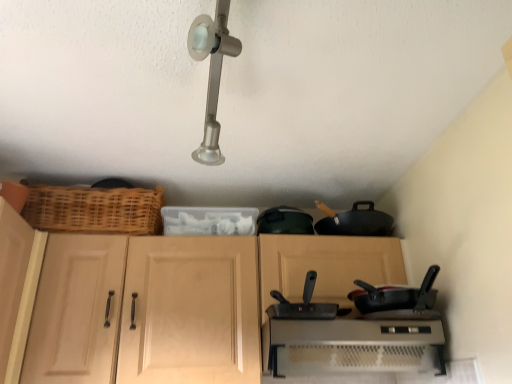
Question: Is the depth of black matte frying pan at right less than that of light wood cabinet at left?

Choices:
 (A) no
 (B) yes

Answer: (A)

Question: From a real-world perspective, is black matte frying pan at right positioned over light wood cabinet at left based on gravity?

Choices:
 (A) yes
 (B) no

Answer: (B)

Question: Would you say black matte frying pan at right contains light wood cabinet at left?

Choices:
 (A) no
 (B) yes

Answer: (A)

Question: Does black matte frying pan at right have a greater width compared to light wood cabinet at left?

Choices:
 (A) yes
 (B) no

Answer: (A)

Question: Is black matte frying pan at right at the right side of light wood cabinet at left?

Choices:
 (A) yes
 (B) no

Answer: (A)

Question: Visually, is light wood cabinet at left positioned to the left or to the right of metallic silver toaster at lower center?

Choices:
 (A) right
 (B) left

Answer: (B)

Question: Based on their sizes in the image, would you say light wood cabinet at left is bigger or smaller than metallic silver toaster at lower center?

Choices:
 (A) big
 (B) small

Answer: (B)

Question: Does point (7, 221) appear closer or farther from the camera than point (416, 334)?

Choices:
 (A) closer
 (B) farther

Answer: (A)

Question: From a real-world perspective, is light wood cabinet at left physically located above or below metallic silver toaster at lower center?

Choices:
 (A) below
 (B) above

Answer: (B)

Question: Based on their sizes in the image, would you say light wood cabinet at left is bigger or smaller than black matte wok at center?

Choices:
 (A) big
 (B) small

Answer: (A)

Question: From their relative heights in the image, would you say light wood cabinet at left is taller or shorter than black matte wok at center?

Choices:
 (A) tall
 (B) short

Answer: (A)

Question: Considering the positions of point (19, 283) and point (295, 306), is point (19, 283) closer or farther from the camera than point (295, 306)?

Choices:
 (A) farther
 (B) closer

Answer: (A)

Question: Based on their positions, is light wood cabinet at left located to the left or right of black matte wok at center?

Choices:
 (A) right
 (B) left

Answer: (B)

Question: Is metallic silver toaster at lower center to the left or to the right of black matte wok at center in the image?

Choices:
 (A) left
 (B) right

Answer: (B)

Question: Considering their positions, is metallic silver toaster at lower center located in front of or behind black matte wok at center?

Choices:
 (A) front
 (B) behind

Answer: (B)